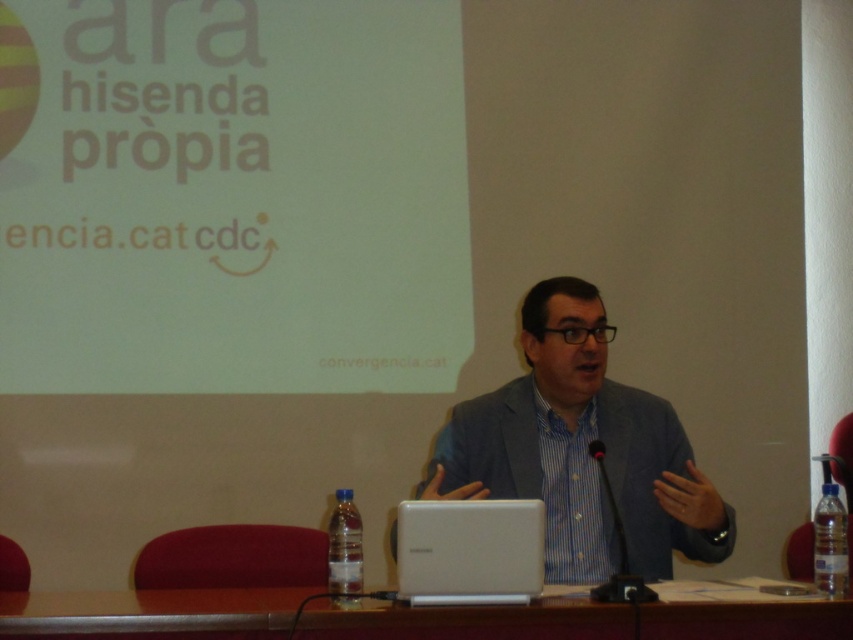
Question: Which of the following is the farthest from the observer?

Choices:
 (A) white plastic laptop at center
 (B) black plastic microphone at center

Answer: (B)

Question: Does wooden table at center have a smaller size compared to black plastic microphone at center?

Choices:
 (A) yes
 (B) no

Answer: (B)

Question: Which object is the farthest from the blue striped shirt at center?

Choices:
 (A) black plastic microphone at center
 (B) white matte projection screen at upper center
 (C) white plastic laptop at center

Answer: (B)

Question: Which of the following is the closest to the observer?

Choices:
 (A) (575, 465)
 (B) (277, 634)
 (C) (166, 380)

Answer: (B)

Question: Does wooden table at center appear under white plastic laptop at center?

Choices:
 (A) no
 (B) yes

Answer: (B)

Question: Can you confirm if white plastic laptop at center is bigger than black plastic microphone at center?

Choices:
 (A) no
 (B) yes

Answer: (A)